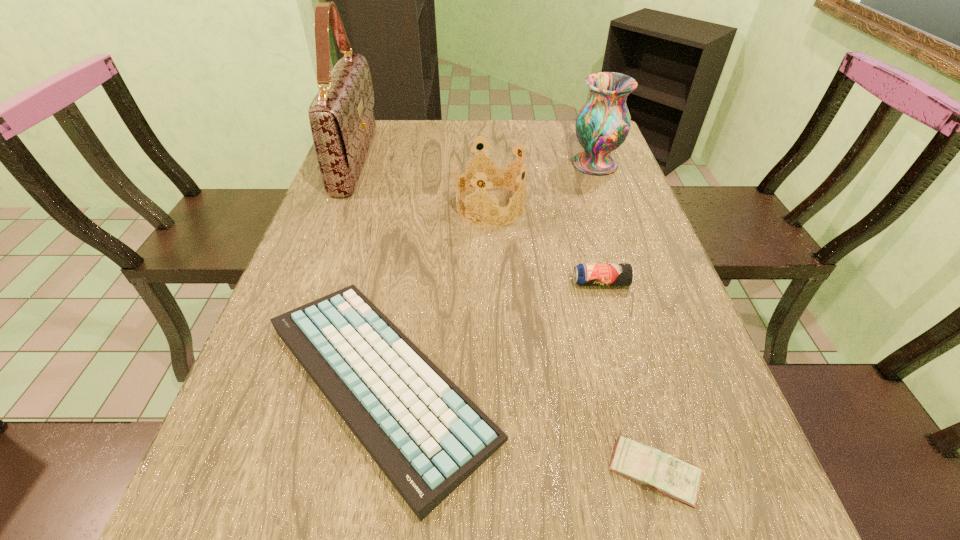
This screenshot has height=540, width=960. In order to click on object that is at the far right corner in this screenshot , I will do `click(602, 125)`.

Locate an element on the screen. The image size is (960, 540). vacant space at the far edge of the desktop is located at coordinates (421, 125).

Locate an element on the screen. blank area at the left edge is located at coordinates (368, 174).

The image size is (960, 540). Find the location of `vacant space at the right edge of the desktop`. vacant space at the right edge of the desktop is located at coordinates (610, 216).

This screenshot has width=960, height=540. I want to click on free region at the far left corner of the desktop, so click(x=397, y=124).

In the image, there is a desktop. Where is `vacant area at the near left corner`? This screenshot has width=960, height=540. vacant area at the near left corner is located at coordinates (194, 525).

The width and height of the screenshot is (960, 540). I want to click on free space between the shortest object and the computer keyboard, so click(517, 427).

Where is `vacant area that lies between the handbag and the shortest object`? The image size is (960, 540). vacant area that lies between the handbag and the shortest object is located at coordinates (505, 316).

The image size is (960, 540). What are the coordinates of `free point between the shortest object and the computer keyboard` in the screenshot? It's located at (517, 427).

Image resolution: width=960 pixels, height=540 pixels. In order to click on vacant area that lies between the tallest object and the third tallest object in this screenshot , I will do `click(423, 183)`.